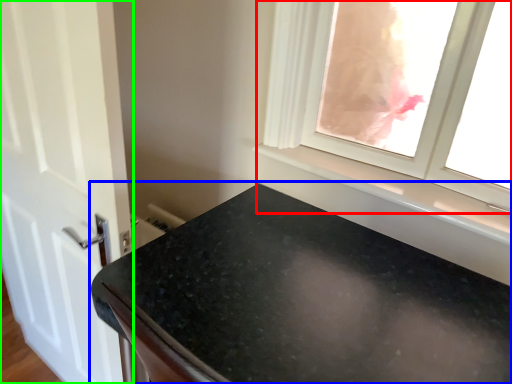
Question: Which object is positioned closest to window (highlighted by a red box)? Select from countertop (highlighted by a blue box) and door (highlighted by a green box).

Choices:
 (A) countertop
 (B) door

Answer: (A)